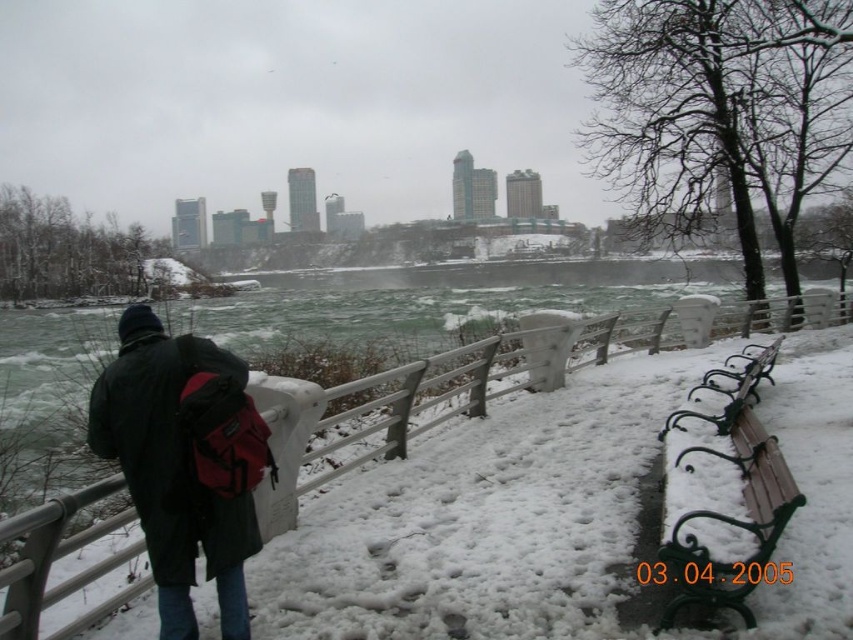
Who is shorter, matte black jacket at left or wooden bench at right?

Standing shorter between the two is wooden bench at right.

Image resolution: width=853 pixels, height=640 pixels. Find the location of `matte black jacket at left`. matte black jacket at left is located at coordinates (173, 467).

Find the location of a particular element. The width and height of the screenshot is (853, 640). matte black jacket at left is located at coordinates (173, 467).